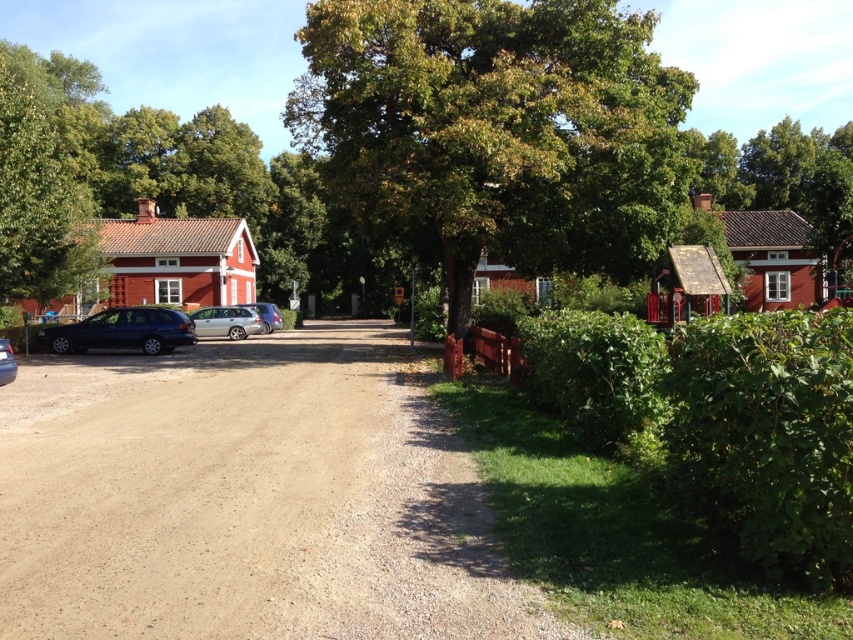
Is green leafy hedge at right below green leafy hedge at lower right?

Yes, green leafy hedge at right is below green leafy hedge at lower right.

Is green leafy hedge at right shorter than green leafy hedge at lower right?

In fact, green leafy hedge at right may be taller than green leafy hedge at lower right.

Who is more forward, (784, 380) or (605, 355)?

Positioned in front is point (784, 380).

Where is `green leafy hedge at right`? green leafy hedge at right is located at coordinates (718, 420).

Does green leafy tree at upper left appear under satin black station wagon at lower left?

Actually, green leafy tree at upper left is above satin black station wagon at lower left.

At what (x,y) coordinates should I click in order to perform the action: click on green leafy tree at upper left. Please return your answer as a coordinate pair (x, y). Looking at the image, I should click on (38, 189).

Is green leafy tree at center positioned before matte black car at left?

No, green leafy tree at center is further to the viewer.

Who is taller, green leafy tree at center or matte black car at left?

With more height is green leafy tree at center.

Locate an element on the screen. Image resolution: width=853 pixels, height=640 pixels. green leafy tree at center is located at coordinates (497, 129).

Locate an element on the screen. green leafy tree at center is located at coordinates (497, 129).